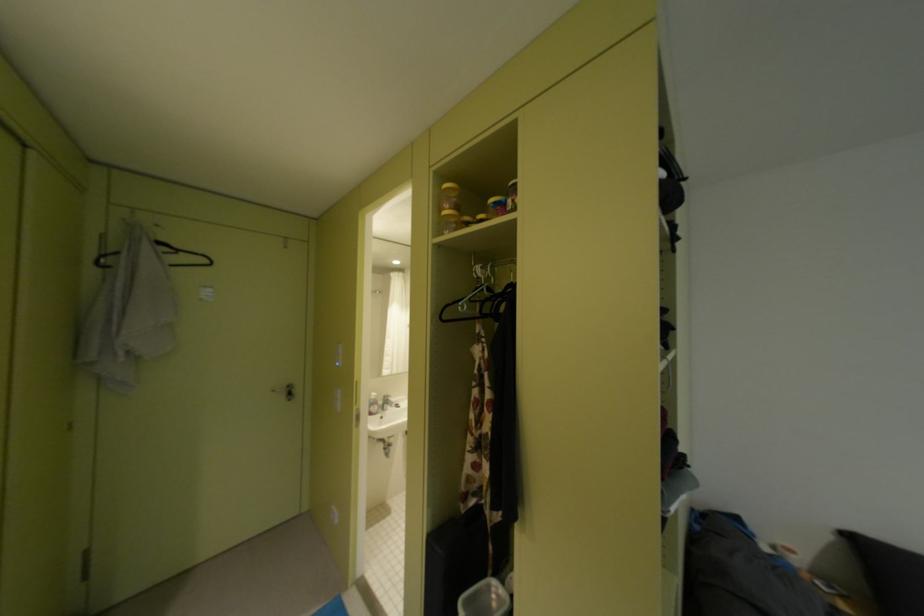
This screenshot has height=616, width=924. In order to click on bathroom sink faucet in this screenshot , I will do `click(387, 402)`.